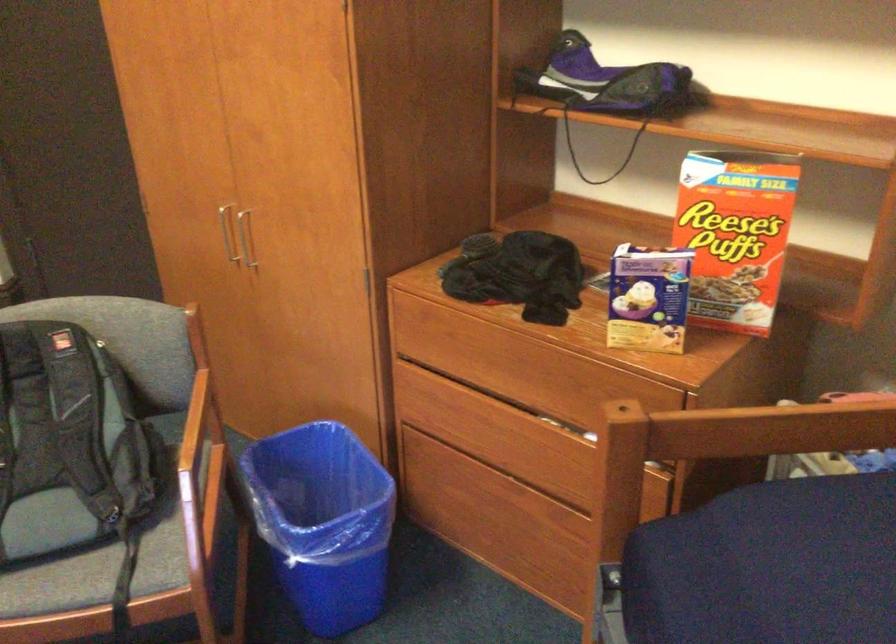
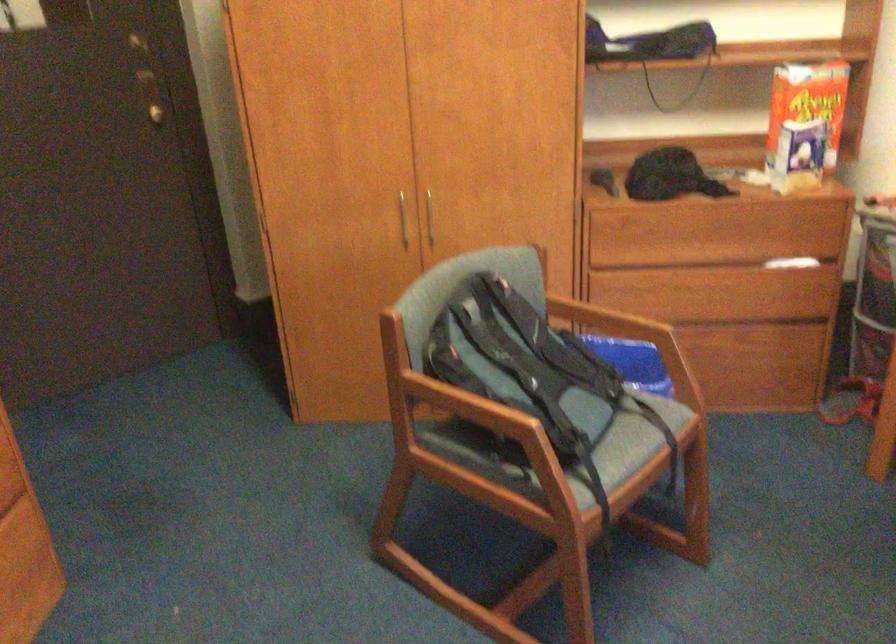
In the second image, find the point that corresponds to (237,243) in the first image.

(402, 220)